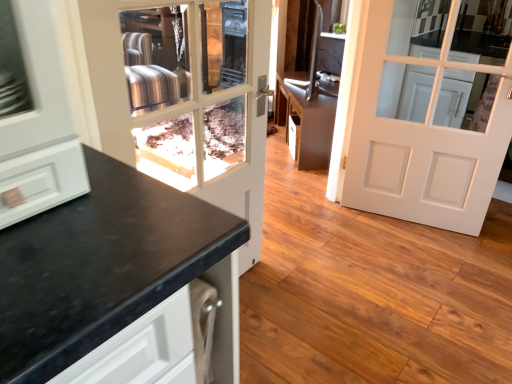
Find the location of `vacant area that lies between white matte door at center, placed as the second door when sorted from left to right, and matte black door at center, marked as the second door in a right-to-left arrangement`. vacant area that lies between white matte door at center, placed as the second door when sorted from left to right, and matte black door at center, marked as the second door in a right-to-left arrangement is located at coordinates coord(351,263).